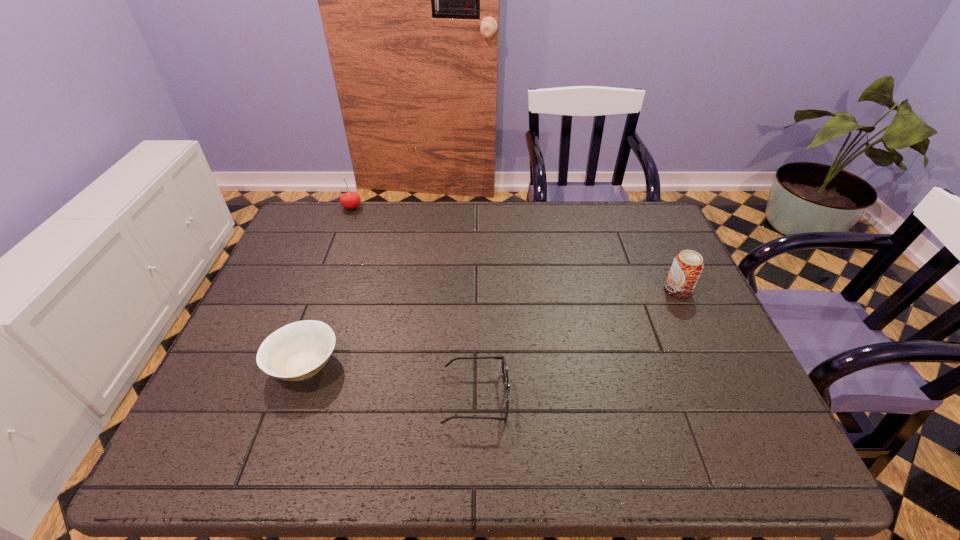
Identify the location of the farthest object. (350, 200).

Image resolution: width=960 pixels, height=540 pixels. Identify the location of beer can. (687, 266).

Find the location of a particular element. The image size is (960, 540). the rightmost object is located at coordinates (687, 266).

Where is `bowl`? bowl is located at coordinates (297, 351).

Find the location of a particular element. The width and height of the screenshot is (960, 540). spectacles is located at coordinates (504, 366).

Image resolution: width=960 pixels, height=540 pixels. I want to click on the third object from left to right, so click(504, 366).

This screenshot has height=540, width=960. I want to click on vacant space located on the front of the farthest object, so click(x=323, y=286).

You are a GUI agent. You are given a task and a screenshot of the screen. Output one action in this format:
    pyautogui.click(x=<x>, y=<y>)
    Task: Click on the free space located 0.260m on the front of the beer can
    
    Given the screenshot: What is the action you would take?
    pyautogui.click(x=721, y=383)

You are a GUI agent. You are given a task and a screenshot of the screen. Output one action in this format:
    pyautogui.click(x=<x>, y=<y>)
    Task: Click on the free region located on the back of the third tallest object
    Image resolution: width=960 pixels, height=540 pixels.
    Given the screenshot: What is the action you would take?
    pyautogui.click(x=342, y=259)

At what (x,y) coordinates should I click in order to perform the action: click on vacant area situated 0.110m on the front-facing side of the shortest object. Please return your answer as a coordinate pair (x, y). The width and height of the screenshot is (960, 540). Looking at the image, I should click on (560, 398).